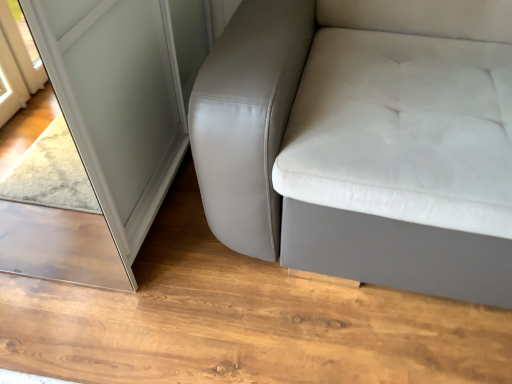
What is the approximate width of suede-like gray couch at center?

38.24 inches.

Where is `suede-like gray couch at center`? This screenshot has height=384, width=512. suede-like gray couch at center is located at coordinates (362, 141).

The height and width of the screenshot is (384, 512). What do you see at coordinates (362, 141) in the screenshot?
I see `suede-like gray couch at center` at bounding box center [362, 141].

Identify the location of suede-like gray couch at center. Image resolution: width=512 pixels, height=384 pixels. pos(362,141).